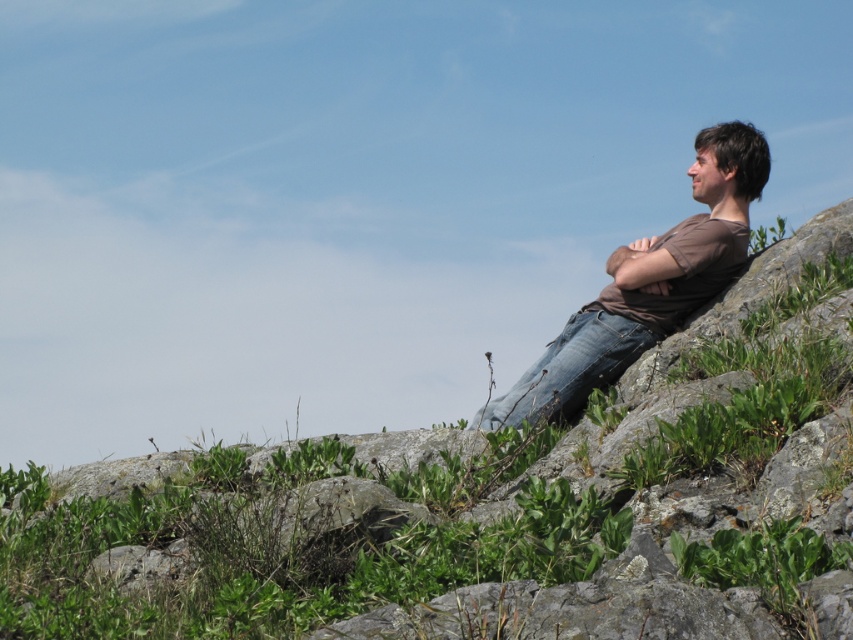
Question: Does green grassy hillside at right appear over brown cotton shirt at right?

Choices:
 (A) yes
 (B) no

Answer: (B)

Question: Estimate the real-world distances between objects in this image. Which object is farther from the brown cotton shirt at right?

Choices:
 (A) green grassy hillside at right
 (B) jeans at right

Answer: (A)

Question: Which object is the farthest from the brown cotton shirt at right?

Choices:
 (A) jeans at right
 (B) green grassy hillside at right

Answer: (B)

Question: Considering the relative positions of green grassy hillside at right and brown cotton shirt at right in the image provided, where is green grassy hillside at right located with respect to brown cotton shirt at right?

Choices:
 (A) below
 (B) above

Answer: (A)

Question: Does green grassy hillside at right have a larger size compared to brown cotton shirt at right?

Choices:
 (A) yes
 (B) no

Answer: (A)

Question: Estimate the real-world distances between objects in this image. Which object is farther from the brown cotton shirt at right?

Choices:
 (A) green grassy hillside at right
 (B) jeans at right

Answer: (A)